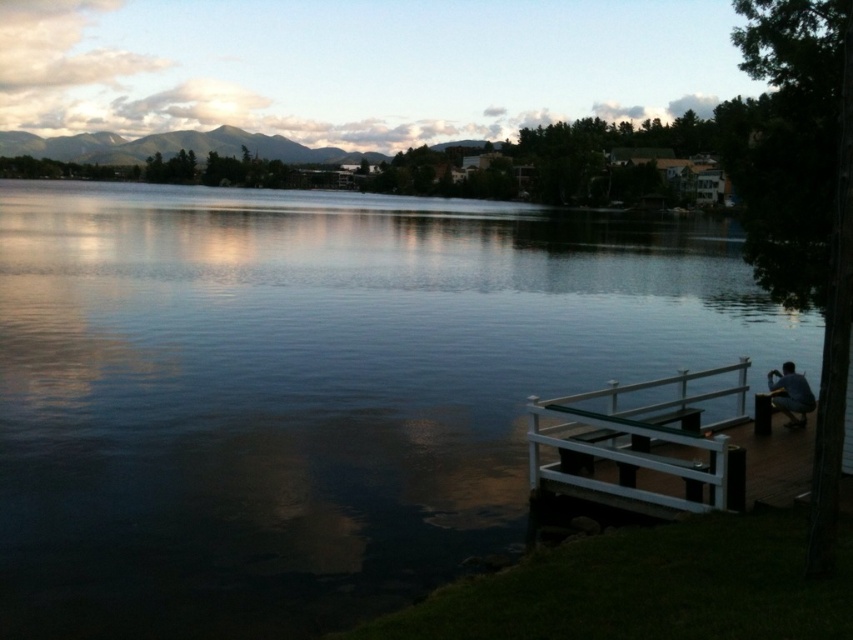
Is smooth dark water at center shorter than dark blue jeans at lower right?

In fact, smooth dark water at center may be taller than dark blue jeans at lower right.

In the scene shown: Which is more to the left, smooth dark water at center or dark blue jeans at lower right?

smooth dark water at center

Who is more forward, (218,381) or (770,394)?

Point (770,394) is in front.

Find the location of `smooth dark water at center`. smooth dark water at center is located at coordinates (311, 388).

Does dark blue jeans at lower right lie in front of wooden park bench at lower right?

No.

Which of these two, dark blue jeans at lower right or wooden park bench at lower right, stands taller?

dark blue jeans at lower right is taller.

Does point (804, 396) come behind point (769, 413)?

No, it is not.

Find the location of a particular element. This screenshot has height=640, width=853. dark blue jeans at lower right is located at coordinates (790, 394).

Is the position of smooth dark water at center less distant than that of wooden park bench at lower right?

Yes, it is.

Which is behind, point (25, 536) or point (764, 416)?

The point (764, 416) is more distant.

Is point (268, 593) less distant than point (755, 420)?

Yes, point (268, 593) is in front of point (755, 420).

Identify the location of smooth dark water at center. (311, 388).